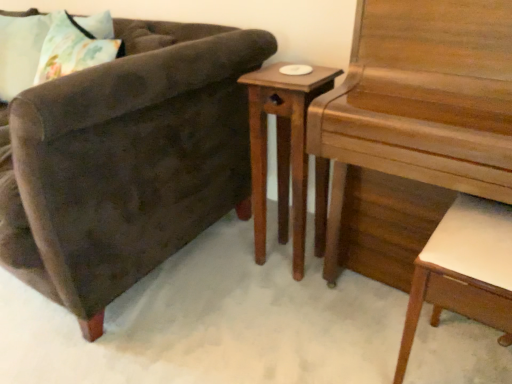
Where is `vacant space in between wooden nightstand at center and white leather desk at lower right`? Image resolution: width=512 pixels, height=384 pixels. vacant space in between wooden nightstand at center and white leather desk at lower right is located at coordinates (355, 314).